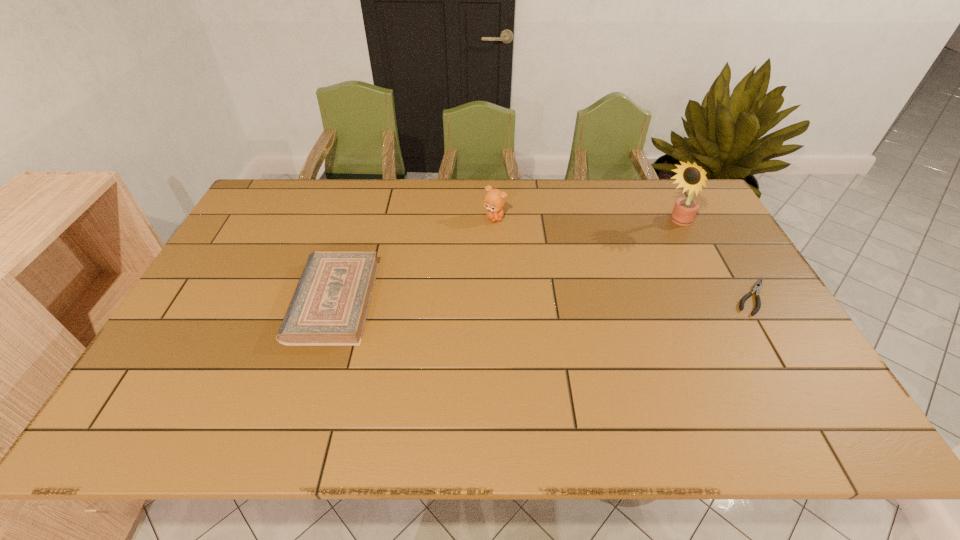
Locate an element on the screen. This screenshot has height=540, width=960. object that is at the far right corner is located at coordinates (692, 177).

Locate an element on the screen. free location at the far edge of the desktop is located at coordinates (310, 207).

Image resolution: width=960 pixels, height=540 pixels. In order to click on vacant region at the near edge in this screenshot , I will do `click(433, 387)`.

I want to click on vacant space at the left edge of the desktop, so click(231, 341).

Where is `vacant space at the right edge of the desktop`? Image resolution: width=960 pixels, height=540 pixels. vacant space at the right edge of the desktop is located at coordinates (790, 352).

Where is `vacant space at the far left corner`? vacant space at the far left corner is located at coordinates coord(273,200).

Locate an element on the screen. The height and width of the screenshot is (540, 960). free space at the near left corner of the desktop is located at coordinates (178, 361).

Where is `blank space at the far right corner of the desktop`? The width and height of the screenshot is (960, 540). blank space at the far right corner of the desktop is located at coordinates (708, 218).

Image resolution: width=960 pixels, height=540 pixels. I want to click on free area in between the Bible and the shortest object, so click(x=543, y=299).

Where is `free space between the Bible and the sunflower`? This screenshot has height=540, width=960. free space between the Bible and the sunflower is located at coordinates [x=505, y=262].